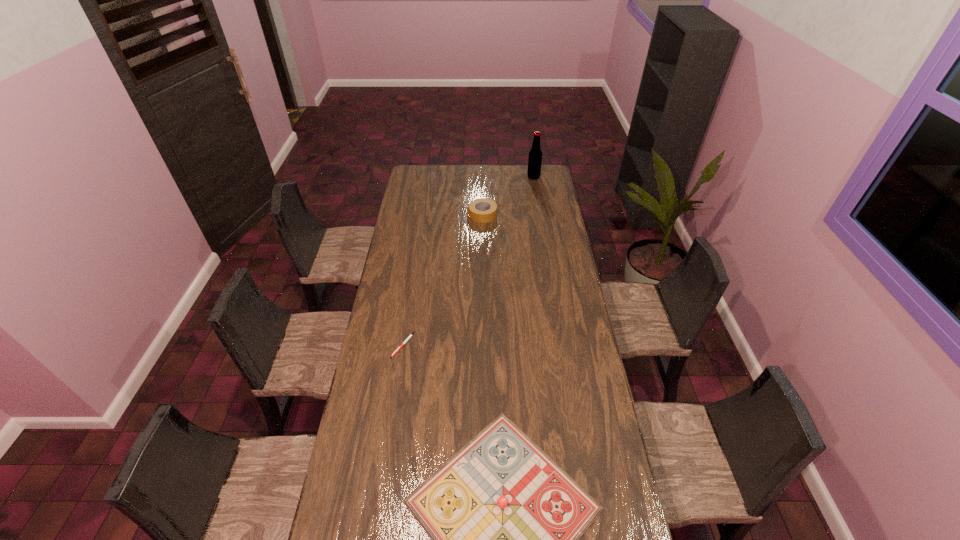
At what (x,y) coordinates should I click in order to perform the action: click on the tallest object. Please return your answer as a coordinate pair (x, y). Looking at the image, I should click on (535, 155).

The width and height of the screenshot is (960, 540). I want to click on beer bottle, so click(535, 155).

The height and width of the screenshot is (540, 960). In order to click on the third nearest object in this screenshot , I will do `click(490, 206)`.

Locate an element on the screen. The image size is (960, 540). duct tape is located at coordinates (490, 206).

At what (x,y) coordinates should I click in order to perform the action: click on the third farthest object. Please return your answer as a coordinate pair (x, y). The height and width of the screenshot is (540, 960). Looking at the image, I should click on (410, 336).

In order to click on the shortest object in this screenshot , I will do `click(410, 336)`.

Identify the location of blank space located 0.190m on the front of the tallest object. The width and height of the screenshot is (960, 540). (537, 198).

At what (x,y) coordinates should I click in order to perform the action: click on blank space located at the edge of the second farthest object. Please return your answer as a coordinate pair (x, y). The width and height of the screenshot is (960, 540). Looking at the image, I should click on (423, 215).

Where is `free space located at the edge of the second farthest object`? This screenshot has width=960, height=540. free space located at the edge of the second farthest object is located at coordinates (430, 215).

The height and width of the screenshot is (540, 960). Find the location of `vacant space located 0.120m at the edge of the second farthest object`. vacant space located 0.120m at the edge of the second farthest object is located at coordinates (446, 215).